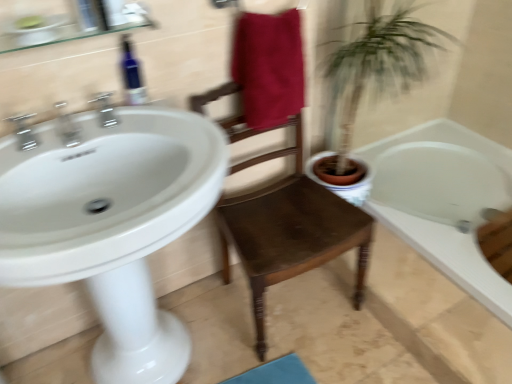
Where is `blank space to the left of silver metallic faucet at upper left, acting as the third tap starting from the left`? The image size is (512, 384). blank space to the left of silver metallic faucet at upper left, acting as the third tap starting from the left is located at coordinates (58, 137).